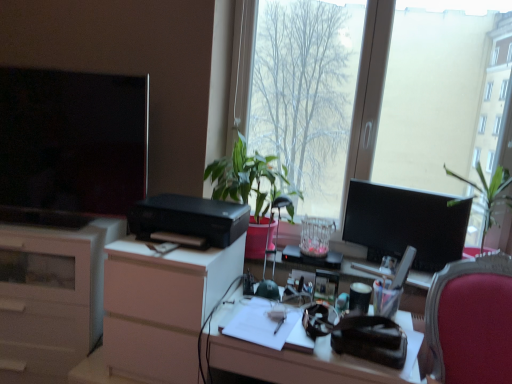
Question: Can you confirm if white glossy cabinet at left is bigger than matte black desk at center?

Choices:
 (A) yes
 (B) no

Answer: (A)

Question: From a real-world perspective, does white glossy cabinet at left stand above matte black desk at center?

Choices:
 (A) no
 (B) yes

Answer: (A)

Question: Is white glossy cabinet at left completely or partially outside of matte black desk at center?

Choices:
 (A) yes
 (B) no

Answer: (A)

Question: Is white glossy cabinet at left at the left side of matte black desk at center?

Choices:
 (A) yes
 (B) no

Answer: (A)

Question: Is white glossy cabinet at left closer to camera compared to matte black desk at center?

Choices:
 (A) no
 (B) yes

Answer: (A)

Question: Is white glossy cabinet at left far away from matte black desk at center?

Choices:
 (A) no
 (B) yes

Answer: (A)

Question: Is white glossy cabinet at left outside of white paper at center?

Choices:
 (A) yes
 (B) no

Answer: (A)

Question: Does white glossy cabinet at left have a greater width compared to white paper at center?

Choices:
 (A) no
 (B) yes

Answer: (B)

Question: Considering the relative sizes of white glossy cabinet at left and white paper at center in the image provided, is white glossy cabinet at left shorter than white paper at center?

Choices:
 (A) yes
 (B) no

Answer: (B)

Question: Is white glossy cabinet at left looking in the opposite direction of white paper at center?

Choices:
 (A) no
 (B) yes

Answer: (A)

Question: Is white glossy cabinet at left not close to white paper at center?

Choices:
 (A) yes
 (B) no

Answer: (B)

Question: Considering the relative positions of white glossy cabinet at left and white paper at center in the image provided, is white glossy cabinet at left to the right of white paper at center from the viewer's perspective?

Choices:
 (A) no
 (B) yes

Answer: (A)

Question: Is white paper at center positioned with its back to matte black television at left, which is the 2th television from right to left?

Choices:
 (A) yes
 (B) no

Answer: (B)